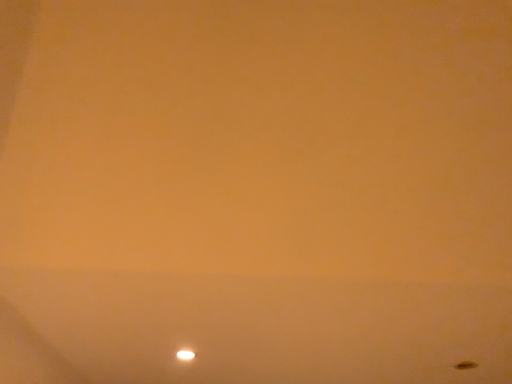
What do you see at coordinates (185, 355) in the screenshot?
I see `white glossy lamp at lower center` at bounding box center [185, 355].

Locate an element on the screen. The width and height of the screenshot is (512, 384). white glossy lamp at lower center is located at coordinates (185, 355).

Locate an element on the screen. Image resolution: width=512 pixels, height=384 pixels. white glossy lamp at lower center is located at coordinates click(185, 355).